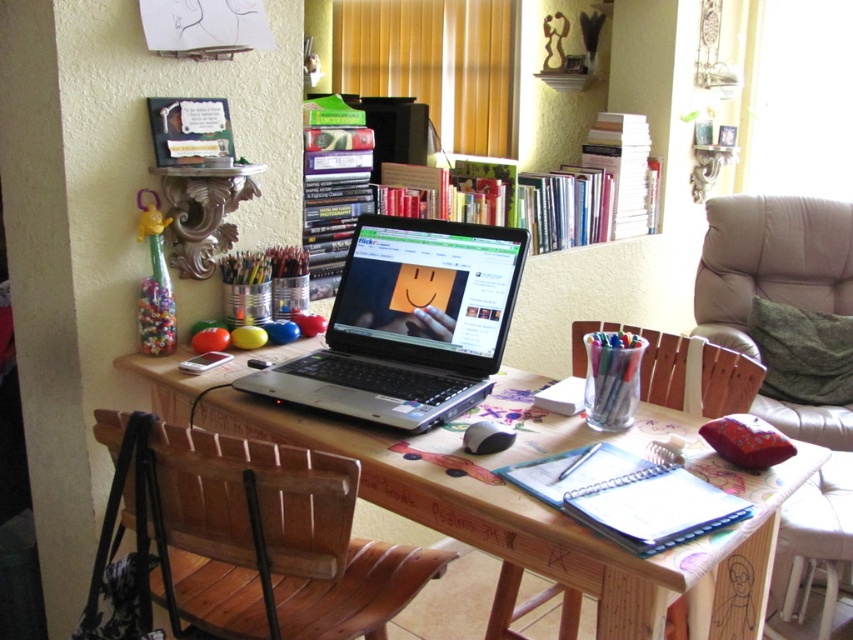
You are standing in the home office and want to place a new decoration on the desk. You have two points marked on the desk surface where you can place it. Which point is closer to you, point 1 at coordinates (624, 572) or point 2 at coordinates (366, 285)?

Point 1 at coordinates (624, 572) is closer to you than point 2 at coordinates (366, 285).